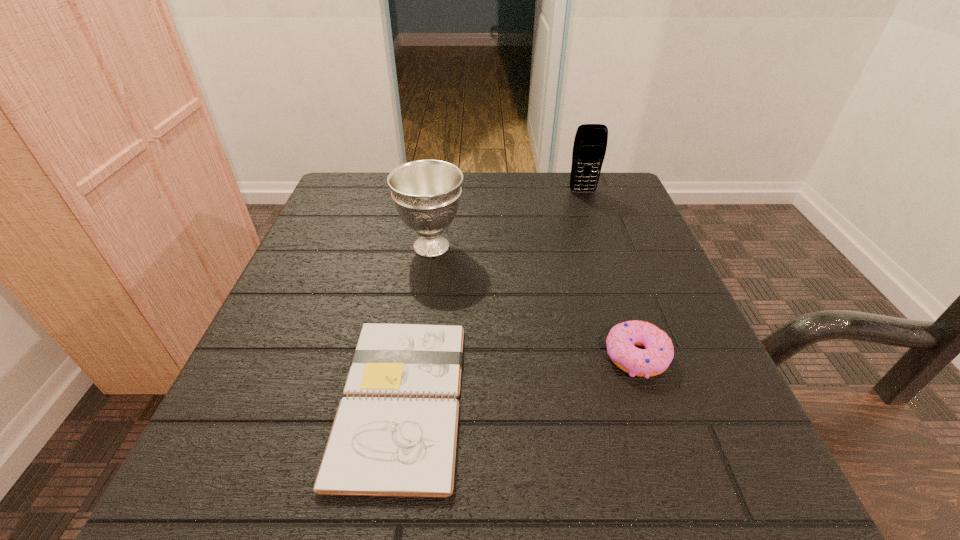
Find the location of a particular element. the farthest object is located at coordinates (590, 143).

The width and height of the screenshot is (960, 540). I want to click on chalice, so click(x=426, y=193).

Locate an element on the screen. the second shortest object is located at coordinates (655, 358).

Locate an element on the screen. Image resolution: width=960 pixels, height=540 pixels. notepad is located at coordinates (395, 433).

What are the coordinates of `free space located 0.330m on the screen of the farthest object` in the screenshot? It's located at (616, 289).

Locate an element on the screen. Image resolution: width=960 pixels, height=540 pixels. vacant space located 0.170m on the left of the second farthest object is located at coordinates pyautogui.click(x=314, y=246).

The height and width of the screenshot is (540, 960). What are the coordinates of `free spot located on the left of the third tallest object` in the screenshot? It's located at (423, 356).

At what (x,y) coordinates should I click in order to perform the action: click on vacant space located on the left of the shortest object. Please return your answer as a coordinate pair (x, y). Looking at the image, I should click on (242, 400).

You are a GUI agent. You are given a task and a screenshot of the screen. Output one action in this format:
    pyautogui.click(x=<x>, y=<y>)
    Task: Click on the object that is at the far edge
    
    Given the screenshot: What is the action you would take?
    pyautogui.click(x=590, y=143)

This screenshot has height=540, width=960. In order to click on object positioned at the near edge in this screenshot , I will do `click(395, 433)`.